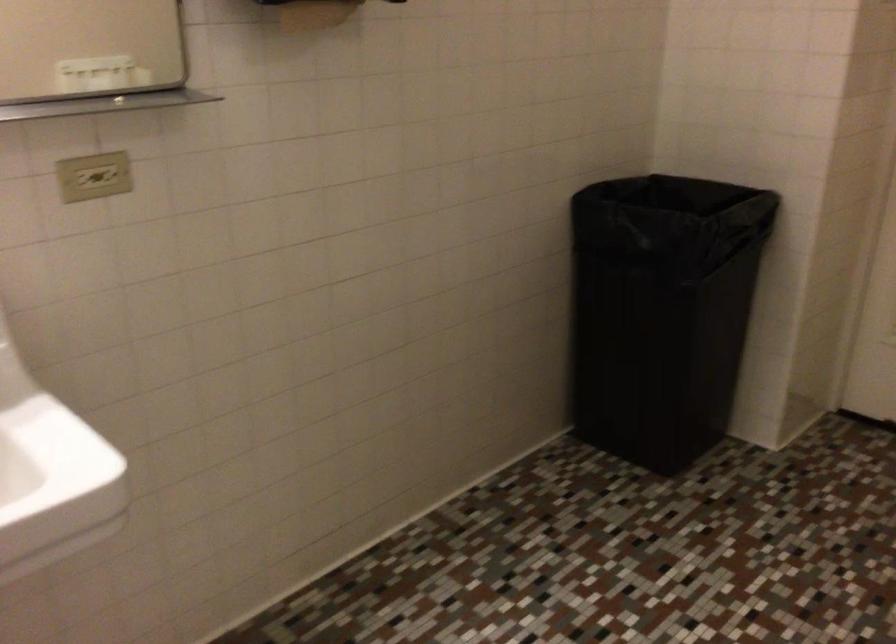
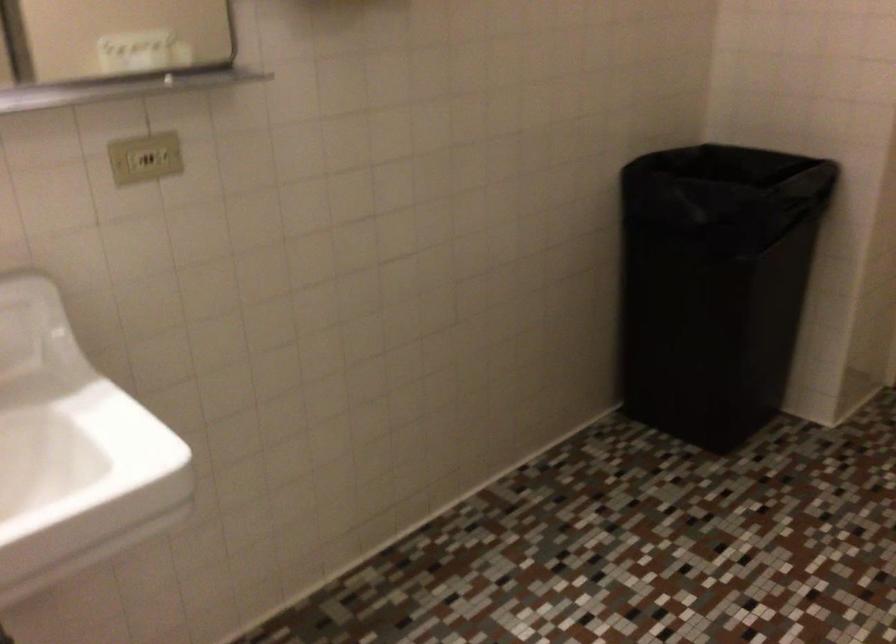
Which direction would the cameraman need to move to produce the second image?

The cameraman walked toward left, forward.